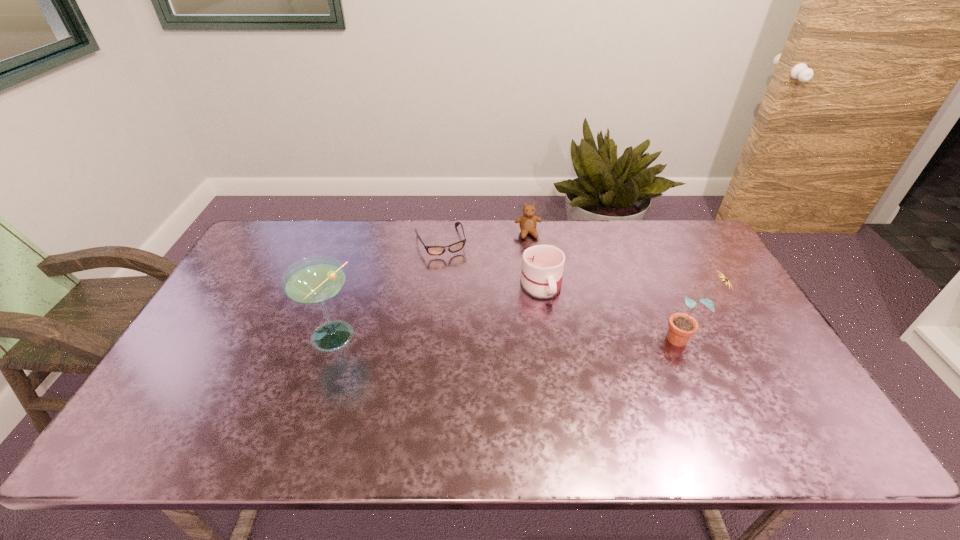
Identify the location of vacant space on the desktop that is between the leftmost object and the rightmost object and is positioned on the side with the handle of the mug. (560, 339).

This screenshot has height=540, width=960. I want to click on free space on the desktop that is between the martini and the rightmost object and is positioned on the front-facing side of the teddy bear, so click(x=557, y=339).

In order to click on vacant spot on the desktop that is between the leftmost object and the sunflower and is positioned on the front-facing side of the shortest object in this screenshot , I will do `click(479, 339)`.